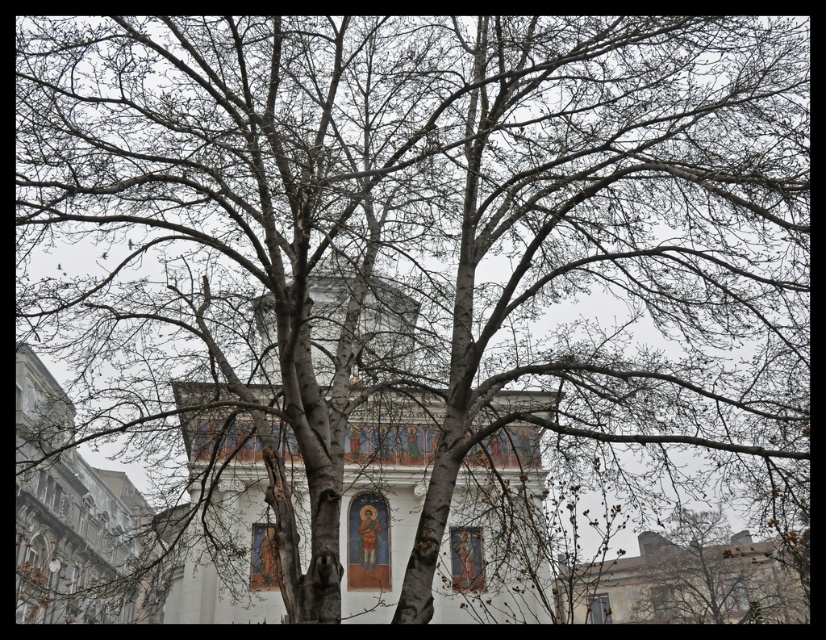
Question: Which of these objects is positioned closest to the white painted wood church at center?

Choices:
 (A) white stone church at lower right
 (B) white stone church at left

Answer: (A)

Question: Which point is farther from the camera taking this photo?

Choices:
 (A) (770, 564)
 (B) (26, 452)
 (C) (192, 424)

Answer: (B)

Question: Which point is closer to the camera?

Choices:
 (A) (682, 602)
 (B) (40, 472)
 (C) (499, 490)

Answer: (C)

Question: Can you confirm if white stone church at left is thinner than white stone church at lower right?

Choices:
 (A) yes
 (B) no

Answer: (A)

Question: Does white painted wood church at center have a lesser width compared to white stone church at lower right?

Choices:
 (A) no
 (B) yes

Answer: (A)

Question: Does white stone church at left appear under white stone church at lower right?

Choices:
 (A) no
 (B) yes

Answer: (A)